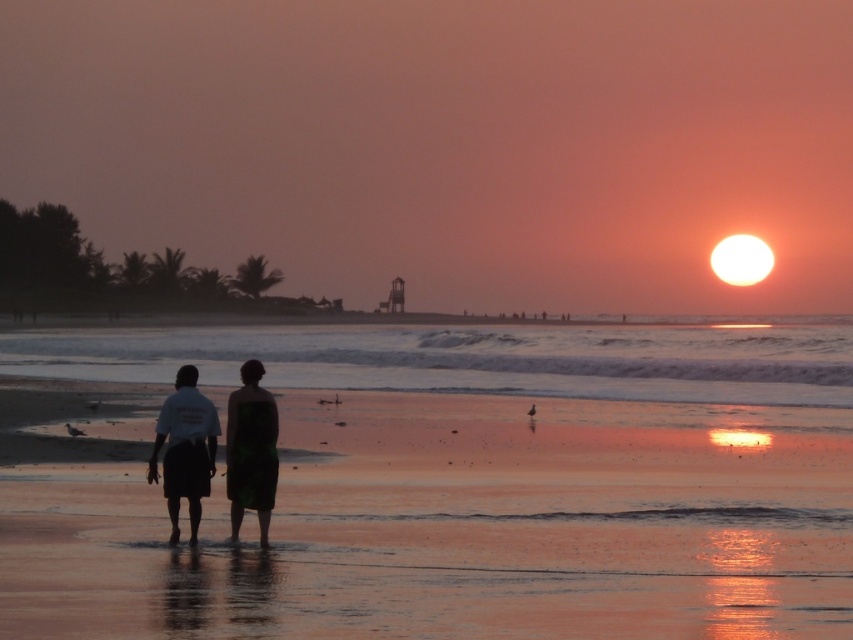
You are a photographer trying to capture a photo of the sunset with the two figures. You want to ensure that both the silhouette shorts at center and the green textured towel at center are clearly visible in the frame. Given their sizes, which object should you focus on to ensure proper exposure?

The silhouette shorts at center is wider than the green textured towel at center, so focusing on the silhouette shorts at center would ensure proper exposure since it covers a larger area in the frame.

You are standing at the beach and see two points marked in the image. The first point is at coordinate point (541, 355) and the second is at point (230, 490). Which point is closer to you?

Point (541, 355) is closer to you because it is further to the viewer than point (230, 490).

You are standing on the beach and want to place your green textured towel at center so it doesn t get wet from the incoming waves. Given that the reflective wet sand at center is higher than the towel, will the towel be safe from the waves?

The reflective wet sand at center has a greater height compared to the green textured towel at center. Since the sand is higher, the waves are less likely to reach the lower positioned towel, so it should be safe from getting wet.